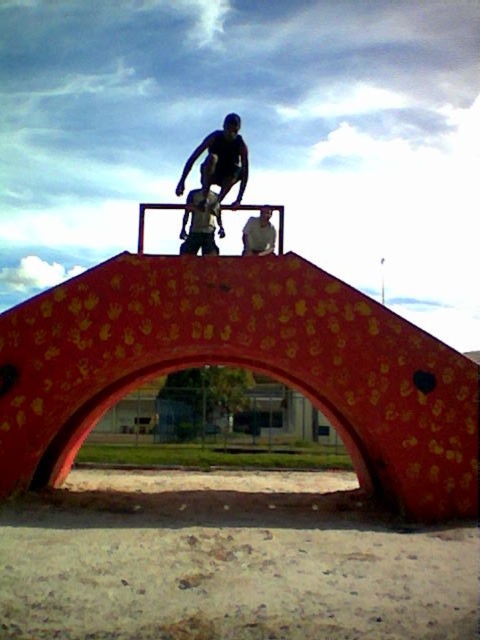
Is point (230, 131) more distant than point (216, 209)?

Yes, it is.

Between matte black skateboarder at center and shiny black skateboard at center, which one has more height?

matte black skateboarder at center

Between point (240, 168) and point (216, 212), which one is positioned in front?

Positioned in front is point (216, 212).

At what (x,y) coordinates should I click in order to perform the action: click on matte black skateboarder at center. Please return your answer as a coordinate pair (x, y). This screenshot has height=640, width=480. Looking at the image, I should click on (219, 161).

Which of these two, white matte shirt at center or shiny black skateboard at center, stands taller?

With more height is white matte shirt at center.

Can you confirm if white matte shirt at center is bigger than shiny black skateboard at center?

Indeed, white matte shirt at center has a larger size compared to shiny black skateboard at center.

Locate an element on the screen. This screenshot has height=640, width=480. white matte shirt at center is located at coordinates (259, 234).

Where is `white matte shirt at center`? white matte shirt at center is located at coordinates (259, 234).

Does point (200, 145) come farther from viewer compared to point (252, 248)?

Yes, it is.

Does matte black skateboarder at center appear over white matte shirt at center?

Yes, matte black skateboarder at center is above white matte shirt at center.

Between point (184, 168) and point (261, 228), which one is positioned behind?

Positioned behind is point (184, 168).

The image size is (480, 640). I want to click on matte black skateboarder at center, so click(x=219, y=161).